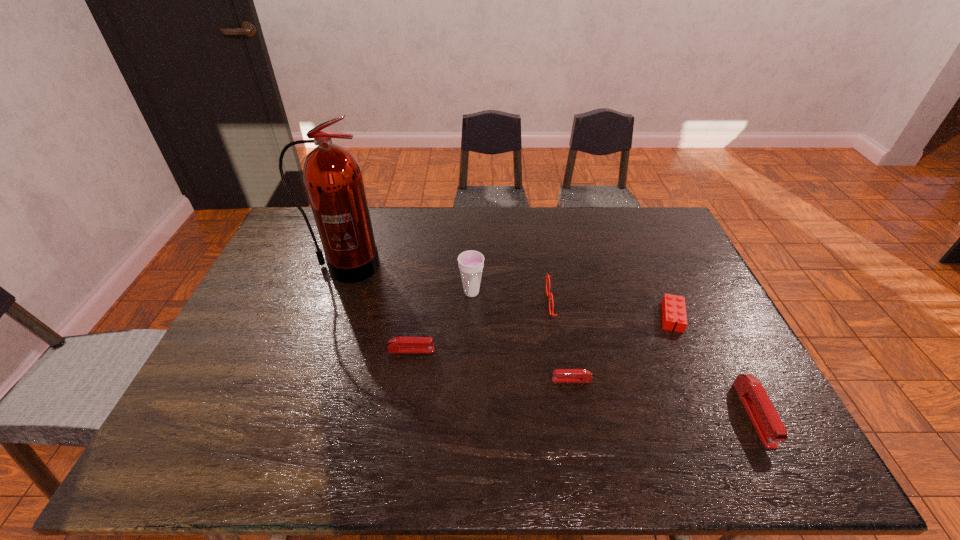
You are a GUI agent. You are given a task and a screenshot of the screen. Output one action in this format:
    pyautogui.click(x=<x>, y=<y>)
    Task: Click on the free location at the near left corner of the desktop
    
    Given the screenshot: What is the action you would take?
    pyautogui.click(x=237, y=400)

Locate an element on the screen. The width and height of the screenshot is (960, 540). free space at the far right corner of the desktop is located at coordinates (635, 207).

I want to click on free space that is in between the shortest stapler and the fire extinguisher, so pyautogui.click(x=458, y=323).

This screenshot has height=540, width=960. In order to click on vacant region between the second stapler from left to right and the Lego in this screenshot , I will do point(622,348).

Identify the location of vacant space in between the shortest stapler and the rightmost stapler. (662, 397).

This screenshot has height=540, width=960. Find the location of `vacant space in between the tallest object and the fifth object from right to left`. vacant space in between the tallest object and the fifth object from right to left is located at coordinates (408, 279).

Find the location of `vacant space that is in between the farthest stapler and the Lego`. vacant space that is in between the farthest stapler and the Lego is located at coordinates (541, 333).

This screenshot has width=960, height=540. I want to click on free space between the leftmost object and the cup, so tap(408, 279).

This screenshot has width=960, height=540. I want to click on vacant point located between the second stapler from right to left and the sixth object from left to right, so click(x=622, y=348).

The image size is (960, 540). I want to click on free space between the rightmost stapler and the shortest stapler, so click(662, 397).